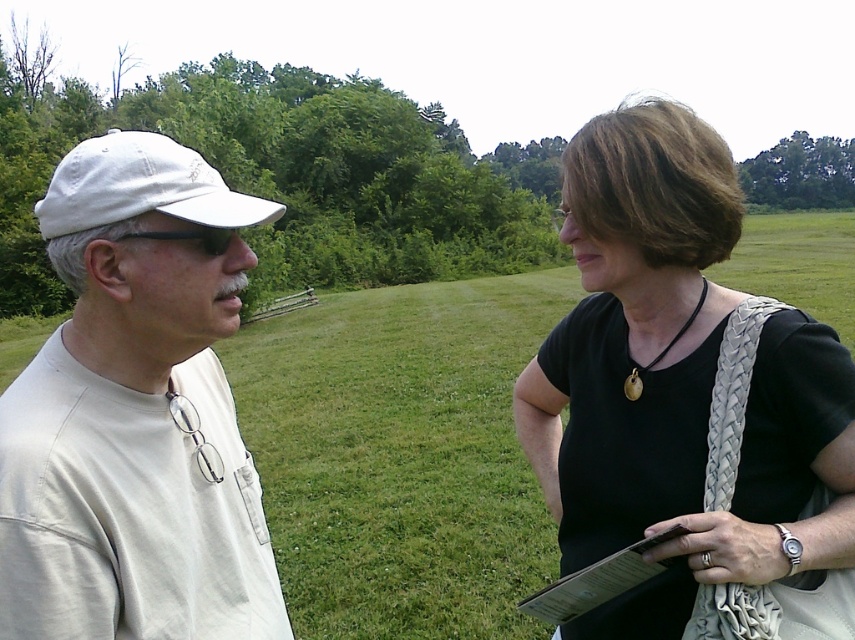
You are a photographer trying to capture a closeup shot of both the white matte cap at left and the black woven purse at right in the scene. Given their sizes, which object should you zoom in more on to ensure both are clearly visible in the frame?

Since the white matte cap at left is smaller than the black woven purse at right, you should zoom in more on the white matte cap at left to ensure both objects are clearly visible in the frame.

You are standing in a field and want to reach the point marked at coordinates point (x=195, y=208). If your walking speed is 1.5 meters per minute, how many minutes will it take you to reach that point?

The distance between you and the point (x=195, y=208) is 1.04 meters. At a speed of 1.5 meters per minute, it would take approximately 0.69 minutes to reach the point.

You are standing in the grassy field and want to walk from point (103, 140) to point (764, 429). Which direction should you face to move towards the closer point?

Point (103, 140) is closer to you, so you should face away from point (764, 429) to move towards the closer point.